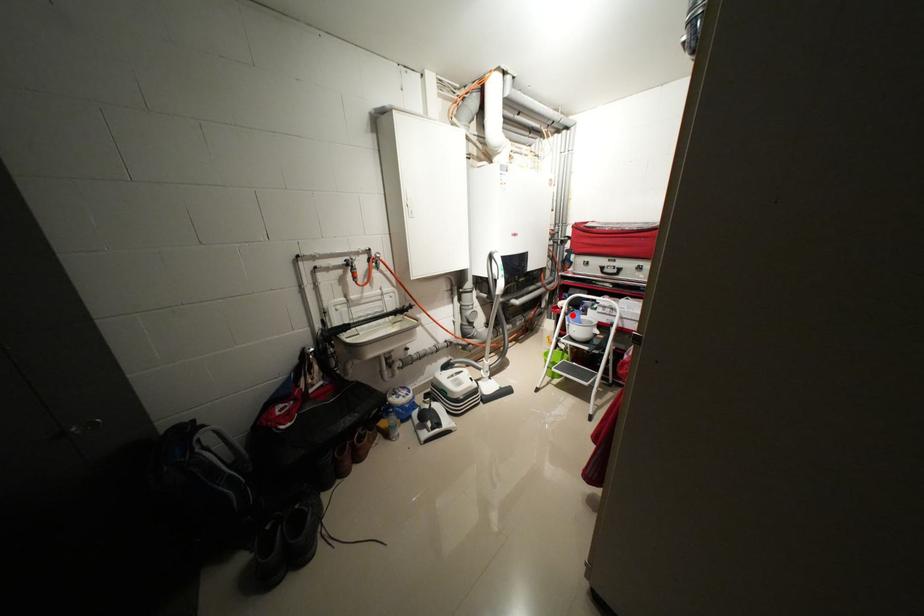
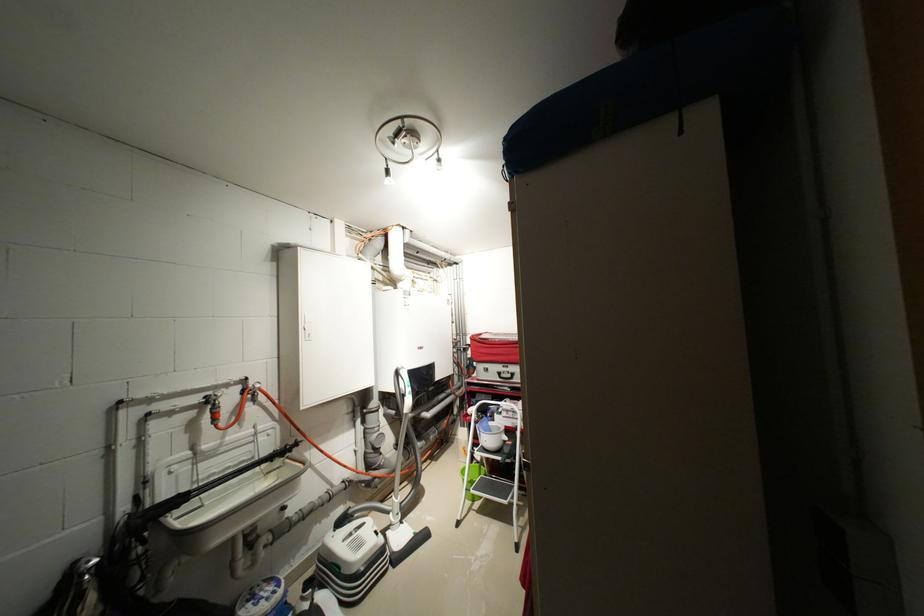
Find the pixel in the second image that matches the highlighted location in the first image.

(482, 424)